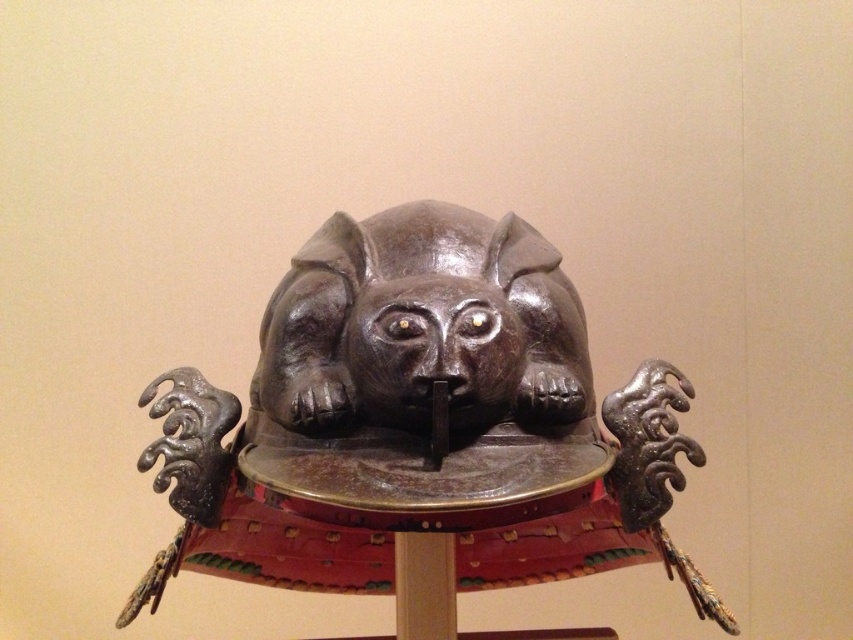
You are an antique collector examining two helmets displayed in a museum. You see a shiny dark brown helmet at center and a shiny brown helmet at center. Which one is bigger?

The shiny dark brown helmet at center is larger in size than the shiny brown helmet at center.